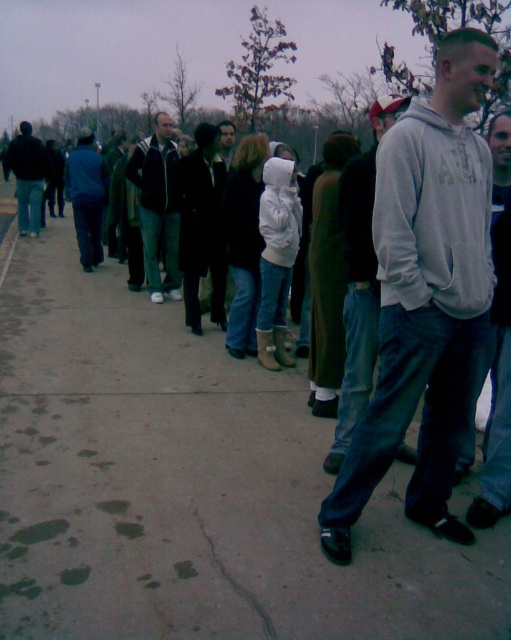
Question: Does gray concrete sidewalk at center appear on the left side of dark blue jeans at left?

Choices:
 (A) no
 (B) yes

Answer: (A)

Question: Considering the relative positions of blue denim jeans at left and dark blue jeans at left in the image provided, where is blue denim jeans at left located with respect to dark blue jeans at left?

Choices:
 (A) right
 (B) left

Answer: (A)

Question: Which point appears closest to the camera in this image?

Choices:
 (A) (71, 196)
 (B) (507, 188)
 (C) (389, 230)

Answer: (C)

Question: Which object is positioned closest to the dark gray jacket at center?

Choices:
 (A) light gray hoodie at right
 (B) blue denim jeans at left
 (C) dark blue jeans at left
 (D) gray sweatshirt at center

Answer: (B)

Question: Which of the following is the closest to the observer?

Choices:
 (A) (371, 385)
 (B) (417, 108)
 (C) (17, 170)
 (D) (503, 195)

Answer: (B)

Question: Is gray hoodie at center positioned behind light gray hoodie at right?

Choices:
 (A) yes
 (B) no

Answer: (A)